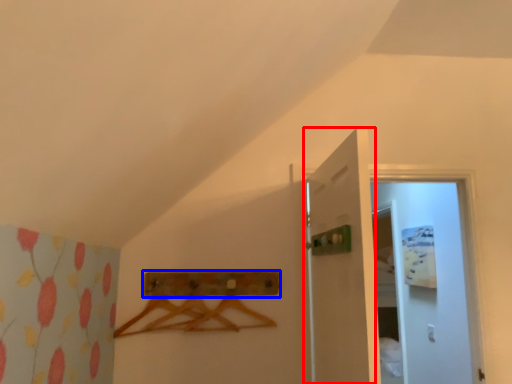
Question: Which point is further to the camera, door (highlighted by a red box) or drawer (highlighted by a blue box)?

Choices:
 (A) door
 (B) drawer

Answer: (B)